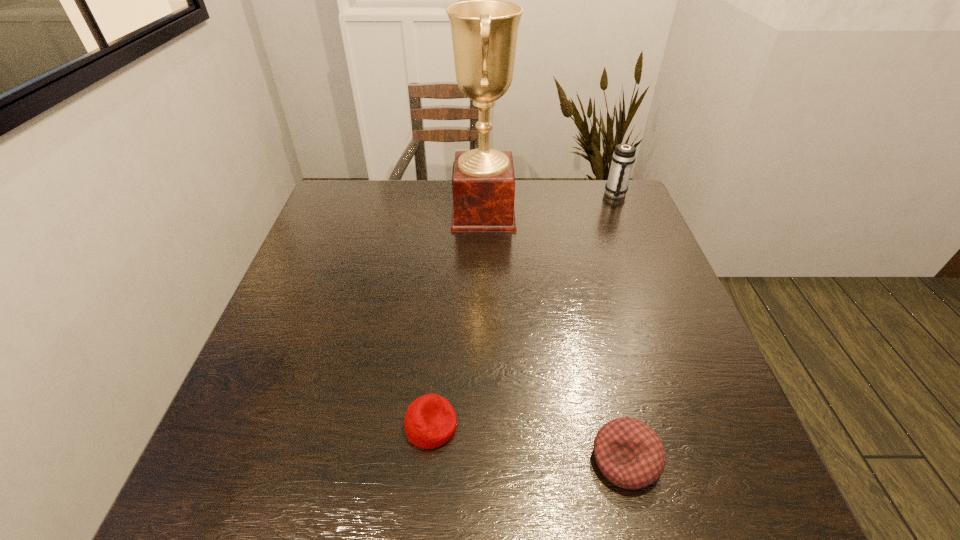
Where is `the tallest object`? The width and height of the screenshot is (960, 540). the tallest object is located at coordinates (484, 29).

Locate an element on the screen. Image resolution: width=960 pixels, height=540 pixels. the third shortest object is located at coordinates pos(623,157).

This screenshot has width=960, height=540. I want to click on thermos bottle, so click(623, 157).

The height and width of the screenshot is (540, 960). What are the coordinates of `the taller beanbag` in the screenshot? It's located at (629, 453).

The height and width of the screenshot is (540, 960). What are the coordinates of `the right beanbag` in the screenshot? It's located at (629, 453).

Identify the location of the shortest object. (430, 421).

Locate an element on the screen. Image resolution: width=960 pixels, height=540 pixels. the left beanbag is located at coordinates (430, 421).

The width and height of the screenshot is (960, 540). Identify the location of vacant space situated on the plaque of the trophy cup. (412, 213).

What are the coordinates of `free spot located 0.190m on the plaque of the trophy cup` in the screenshot? It's located at [389, 213].

This screenshot has height=540, width=960. I want to click on free space located 0.110m on the plaque of the trophy cup, so click(416, 213).